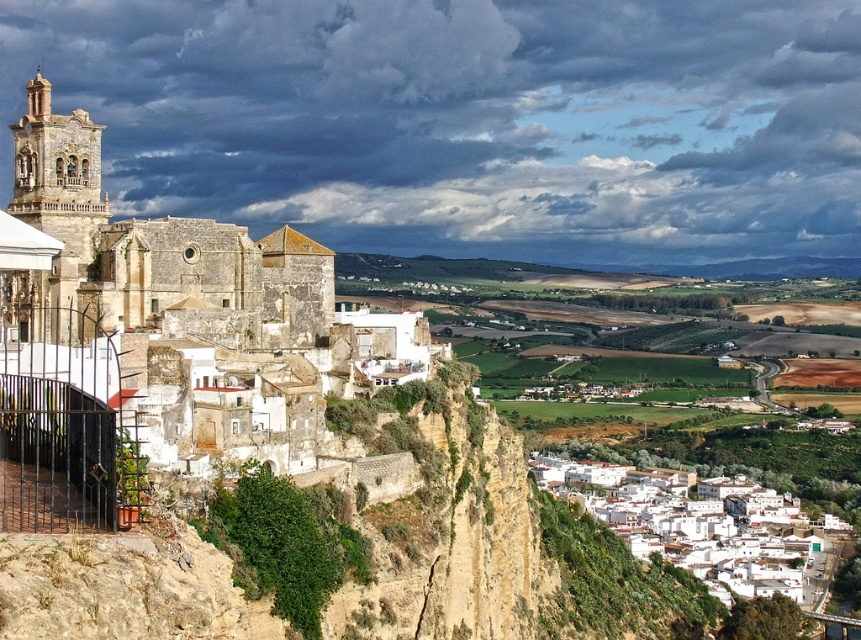
You are a tourist standing at the base of the cliff looking up at the town. Which of the two landmarks, the white matte buildings at lower right or the light beige stone tower at left, is positioned higher up on the cliff?

The light beige stone tower at left is positioned higher up on the cliff than the white matte buildings at lower right, as the white matte buildings at lower right is below it.

You are a tourist standing at the base of the cliff looking up at the historic town. You notice the stone church at left and the light beige stone tower at left. Which one is positioned more to the right from your viewpoint?

The stone church at left is positioned more to the right from your viewpoint compared to the light beige stone tower at left, as it is located to the right of it.

You are a tourist standing on the cliff edge looking at the historic town. You want to take a photo that includes both the stone church at left and the white matte buildings at lower right. Which direction should you move to ensure both are in the frame?

You should move to the right so that both the stone church at left and the white matte buildings at lower right can be captured in the photo frame since the stone church at left is positioned to the left of the white matte buildings at lower right.